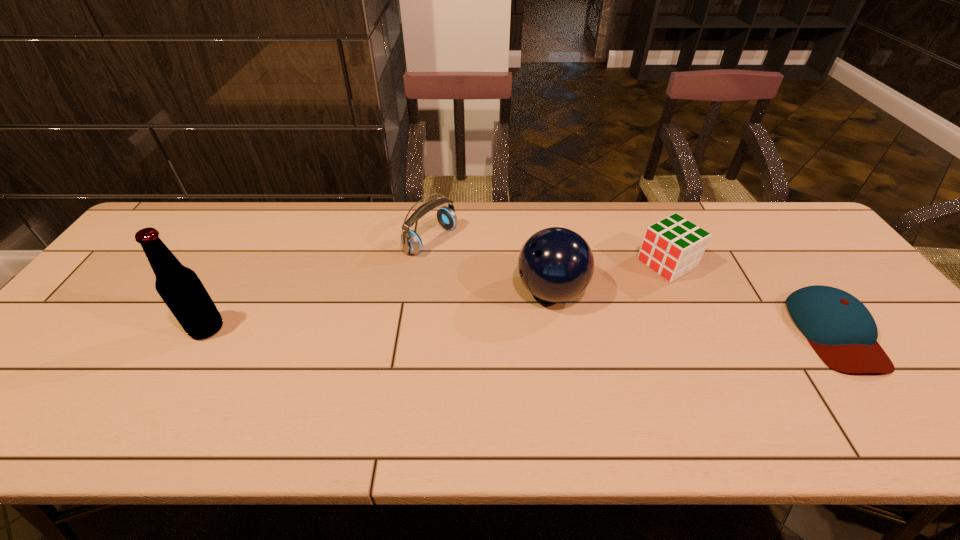
At what (x,y) coordinates should I click in order to perform the action: click on beer bottle. Please return your answer as a coordinate pair (x, y). The width and height of the screenshot is (960, 540). Looking at the image, I should click on (180, 288).

The width and height of the screenshot is (960, 540). In order to click on the leftmost object in this screenshot , I will do `click(180, 288)`.

Where is `the shortest object`? The image size is (960, 540). the shortest object is located at coordinates [841, 330].

Identify the location of baseball cap. This screenshot has width=960, height=540. (841, 330).

Find the location of a particular element. This screenshot has height=540, width=960. the fourth object from left to right is located at coordinates (673, 246).

Identify the location of the second shortest object. (673, 246).

The image size is (960, 540). Identify the location of the third tallest object. pos(412,244).

This screenshot has height=540, width=960. Identify the location of the second object from left to right. (412, 244).

What are the coordinates of `the fourth shortest object` in the screenshot? It's located at (556, 264).

You are a GUI agent. You are given a task and a screenshot of the screen. Output one action in this format:
    pyautogui.click(x=<x>, y=<y>)
    Task: Click on the third object from right to left
    
    Given the screenshot: What is the action you would take?
    pyautogui.click(x=556, y=264)